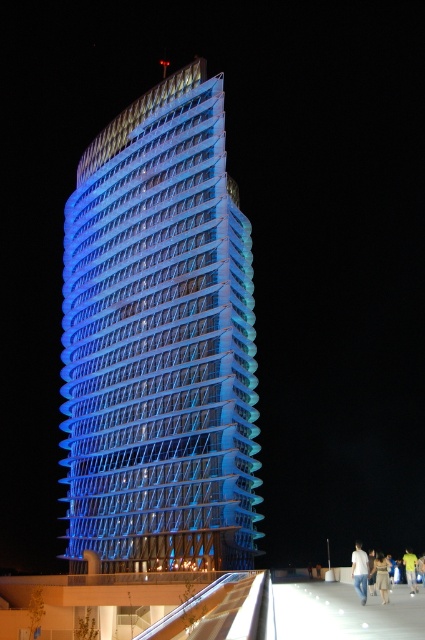
Does white cotton shirt at lower right appear on the left side of yellow t-shirt at lower right?

Correct, you'll find white cotton shirt at lower right to the left of yellow t-shirt at lower right.

Does point (357, 540) come in front of point (410, 579)?

No, it is behind (410, 579).

Where is `white cotton shirt at lower right`? white cotton shirt at lower right is located at coordinates (359, 570).

Measure the distance from blue glass tower at center to yellow t-shirt at lower right.

blue glass tower at center and yellow t-shirt at lower right are 100.70 feet apart from each other.

Is blue glass tower at center closer to the viewer compared to yellow t-shirt at lower right?

That is False.

Is point (167, 518) positioned behind point (408, 560)?

Yes.

Where is `blue glass tower at center`? The height and width of the screenshot is (640, 425). blue glass tower at center is located at coordinates (159, 340).

Does blue glass tower at center appear on the left side of light brown fabric dress at lower right?

Yes, blue glass tower at center is to the left of light brown fabric dress at lower right.

Image resolution: width=425 pixels, height=640 pixels. Describe the element at coordinates (159, 340) in the screenshot. I see `blue glass tower at center` at that location.

The image size is (425, 640). What do you see at coordinates (159, 340) in the screenshot?
I see `blue glass tower at center` at bounding box center [159, 340].

In order to click on blue glass tower at center in this screenshot , I will do `click(159, 340)`.